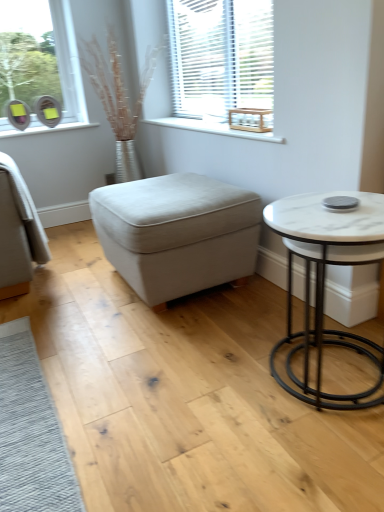
Identify the location of vacant space to the left of white marble table at right. (203, 389).